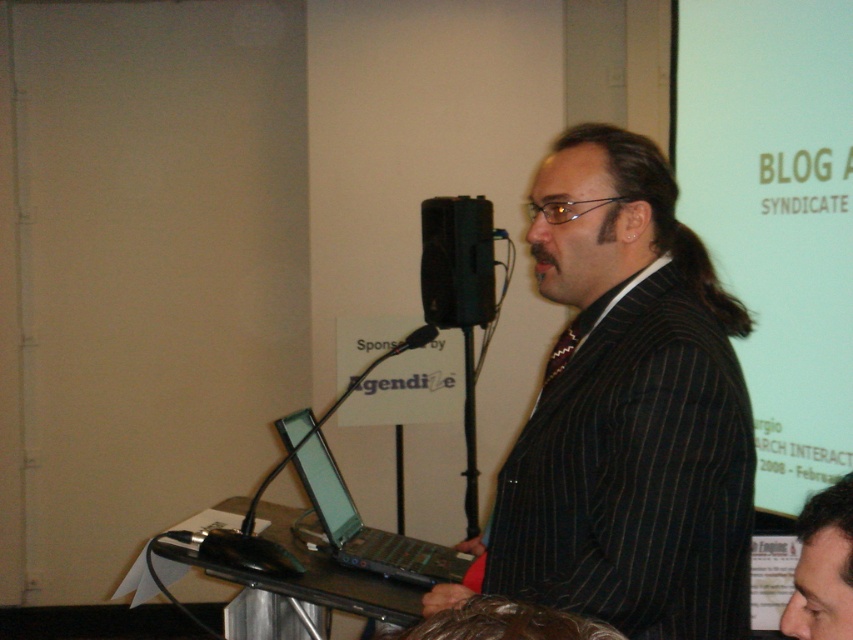
You are a photographer positioned at the camera. You need to capture a closeup shot of the black plastic laptop at lower left. Can you move closer to the laptop without leaving the event venue to get a better shot?

The black plastic laptop at lower left is 6.47 feet from camera. Since you can move closer within the venue, you can reduce the distance to achieve a better closeup shot.